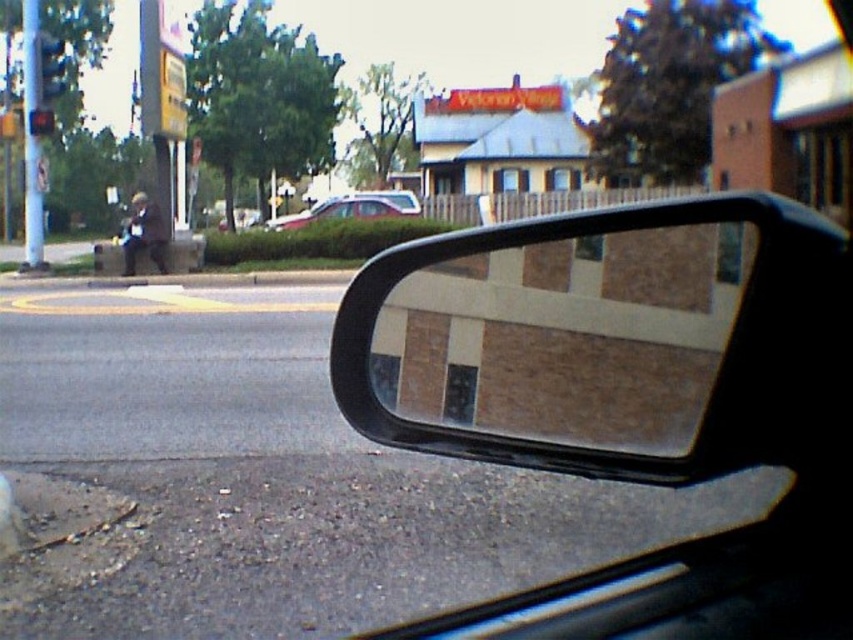
Question: Can you confirm if matte brown mirror at right is thinner than metallic traffic light at upper left?

Choices:
 (A) yes
 (B) no

Answer: (B)

Question: Which point is farther to the camera?

Choices:
 (A) (32, 109)
 (B) (286, 224)

Answer: (B)

Question: Based on their relative distances, which object is nearer to the silver metallic sedan at center?

Choices:
 (A) matte brown mirror at right
 (B) metallic traffic light at upper left
 (C) metallic blue traffic light at upper left

Answer: (B)

Question: Which object appears farthest from the camera in this image?

Choices:
 (A) metallic blue traffic light at upper left
 (B) silver metallic sedan at center
 (C) matte brown mirror at right

Answer: (B)

Question: Is silver metallic sedan at center behind metallic blue traffic light at upper left?

Choices:
 (A) yes
 (B) no

Answer: (A)

Question: Does matte brown mirror at right appear on the right side of silver metallic sedan at center?

Choices:
 (A) no
 (B) yes

Answer: (B)